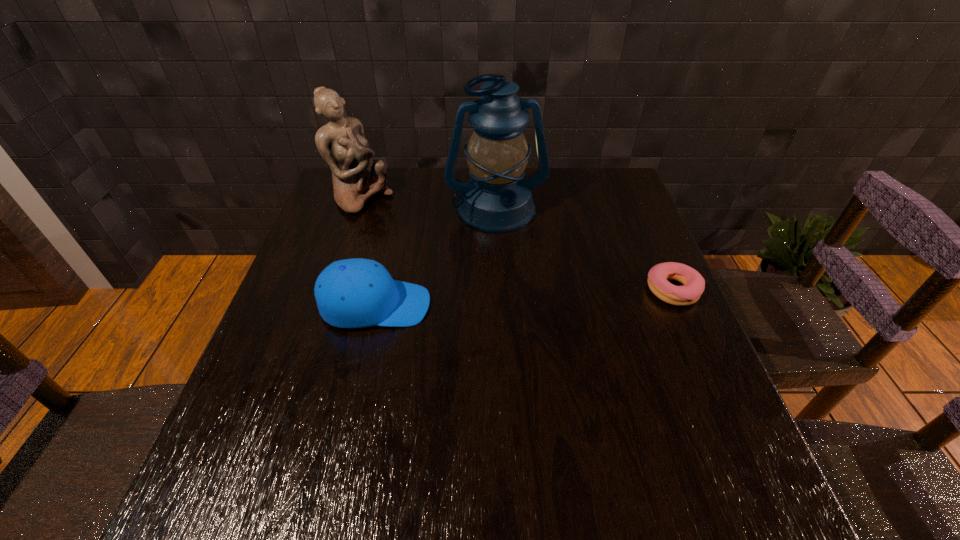
This screenshot has width=960, height=540. Identify the location of free space located on the face of the lantern. (514, 271).

Locate an element on the screen. vacant space located on the front-facing side of the third shortest object is located at coordinates (403, 226).

The height and width of the screenshot is (540, 960). Identify the location of vacant area located 0.390m on the front-facing side of the third shortest object. (479, 274).

At what (x,y) coordinates should I click in order to perform the action: click on vacant position located 0.160m on the front-facing side of the third shortest object. Please return your answer as a coordinate pair (x, y). Looking at the image, I should click on (418, 234).

You are a GUI agent. You are given a task and a screenshot of the screen. Output one action in this format:
    pyautogui.click(x=<x>, y=<y>)
    Task: Click on the lantern that is at the far edge
    
    Given the screenshot: What is the action you would take?
    pyautogui.click(x=496, y=200)

Locate an element on the screen. Image resolution: width=960 pixels, height=540 pixels. figurine positioned at the far edge is located at coordinates click(x=356, y=177).

Find the location of a particular element. This screenshot has height=540, width=960. cap at the left edge is located at coordinates (355, 293).

The image size is (960, 540). I want to click on figurine that is at the left edge, so click(x=356, y=177).

Image resolution: width=960 pixels, height=540 pixels. I want to click on object at the right edge, so click(x=693, y=283).

Identify the location of object that is at the far left corner. The width and height of the screenshot is (960, 540). pos(356,177).